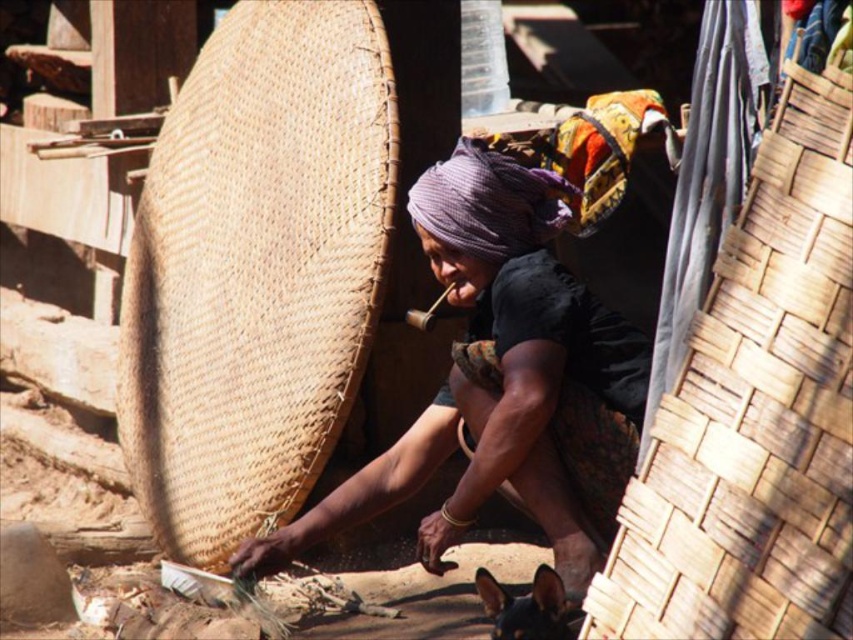
You are a visitor observing the craftsperson and their materials. Which object, the matte woven basket at center or the black glossy dog at lower right, occupies more space in the scene?

The matte woven basket at center has a larger size compared to the black glossy dog at lower right, so it occupies more space in the scene.